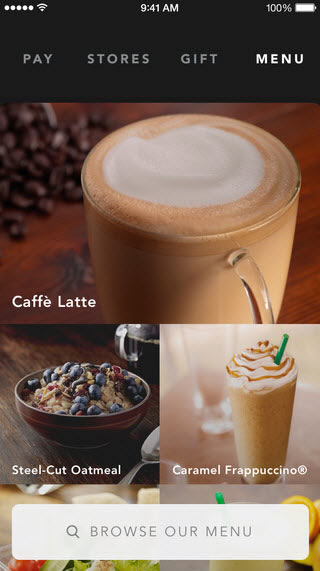
Where is `glass mug of black coffee`? glass mug of black coffee is located at coordinates (150, 340).